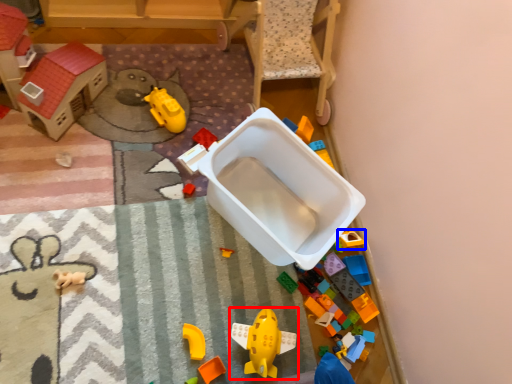
Question: Which point is further to the camera, toy (highlighted by a red box) or toy (highlighted by a blue box)?

Choices:
 (A) toy
 (B) toy

Answer: (B)